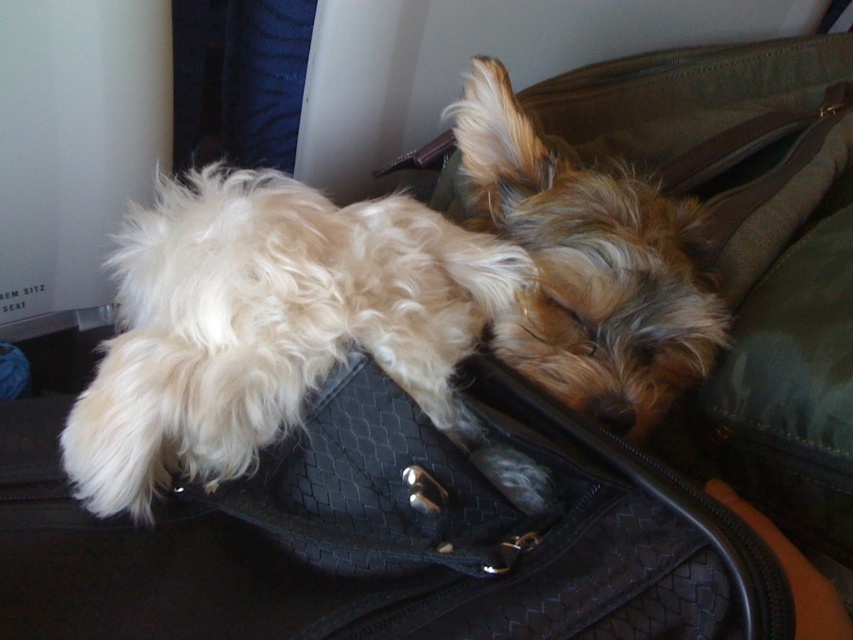
Question: Can you confirm if white fluffy dog at center is thinner than fuzzy brown dog at center?

Choices:
 (A) no
 (B) yes

Answer: (A)

Question: Is white fluffy dog at center in front of fuzzy brown dog at center?

Choices:
 (A) yes
 (B) no

Answer: (A)

Question: Is white fluffy dog at center below fuzzy brown dog at center?

Choices:
 (A) yes
 (B) no

Answer: (A)

Question: Among these points, which one is nearest to the camera?

Choices:
 (A) pyautogui.click(x=260, y=348)
 (B) pyautogui.click(x=604, y=344)

Answer: (A)

Question: Which of the following is the farthest from the observer?

Choices:
 (A) white fluffy dog at center
 (B) fuzzy brown dog at center

Answer: (B)